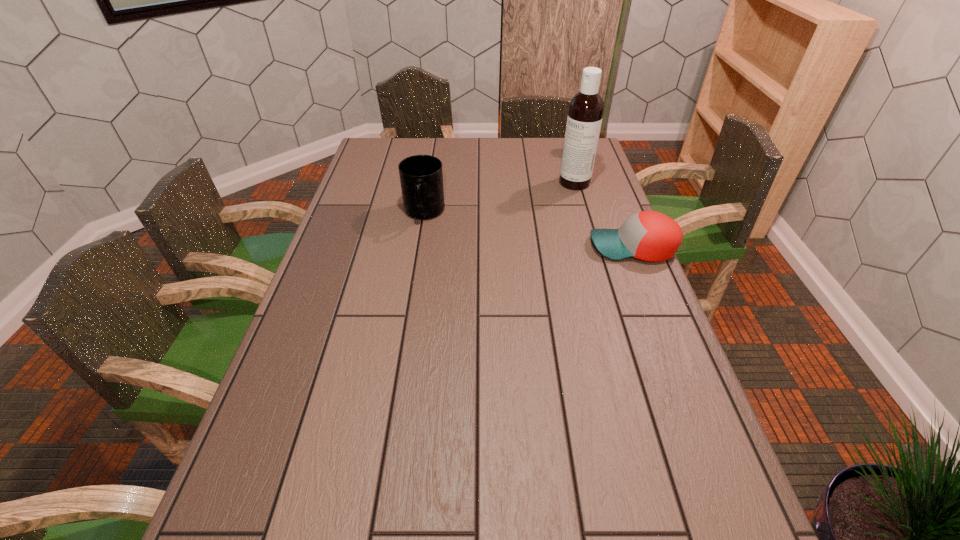
This screenshot has width=960, height=540. Identify the location of mug. (421, 177).

Identify the location of the leftmost object. (421, 177).

You are a GUI agent. You are given a task and a screenshot of the screen. Output one action in this format:
    pyautogui.click(x=<x>, y=<y>)
    Task: Click on the nearest object
    This screenshot has width=960, height=540.
    Given the screenshot: What is the action you would take?
    [651, 236]

You are a GUI agent. You are given a task and a screenshot of the screen. Output one action in this format:
    pyautogui.click(x=<x>, y=<y>)
    Task: Click on the baseball cap
    The height and width of the screenshot is (540, 960).
    Given the screenshot: What is the action you would take?
    tap(651, 236)

This screenshot has height=540, width=960. Identify the location of the tallest object. (586, 108).

Where is `dishwasher detergent`? dishwasher detergent is located at coordinates (x=586, y=108).

You are a GUI agent. You are given a task and a screenshot of the screen. Output one action in this format:
    pyautogui.click(x=<x>, y=<y>)
    Task: Click on the free space located 0.400m on the side of the leftmost object with the handle
    The image size is (960, 540).
    Given the screenshot: What is the action you would take?
    pyautogui.click(x=406, y=325)

Identify the location of vacant space located 0.270m at the brim of the nearest object. (500, 247).

What are the coordinates of `vacant region located 0.090m at the brim of the nearest object` in the screenshot? It's located at (560, 247).

Where is `free space located 0.270m at the brim of the nearest object`? The width and height of the screenshot is (960, 540). free space located 0.270m at the brim of the nearest object is located at coordinates click(500, 247).